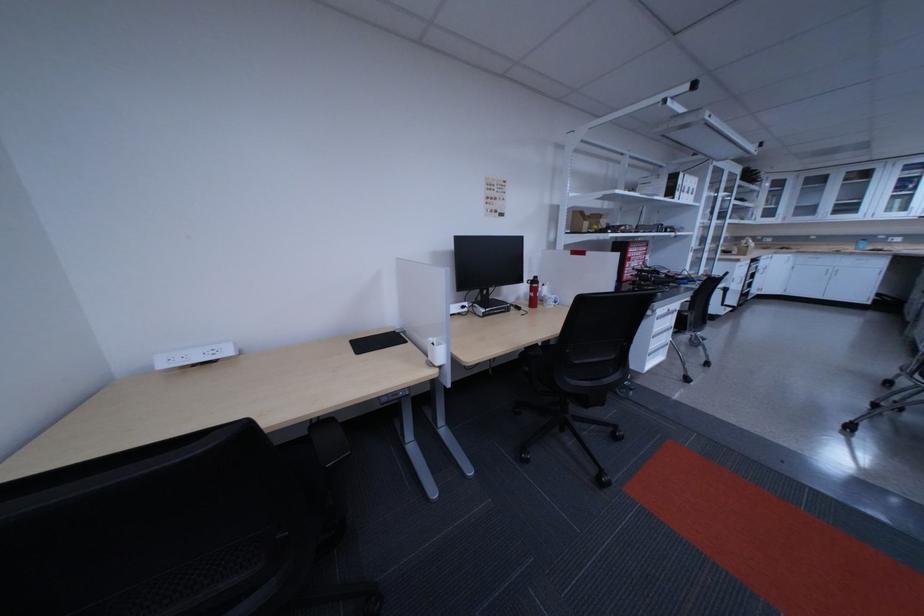
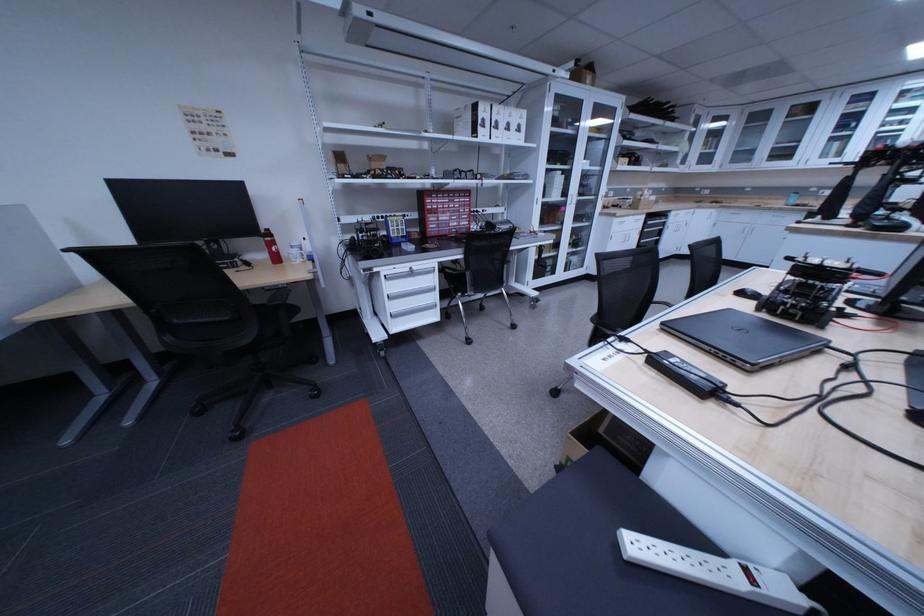
Find the pixel in the second image that matches (688,179) in the first image.

(490, 110)